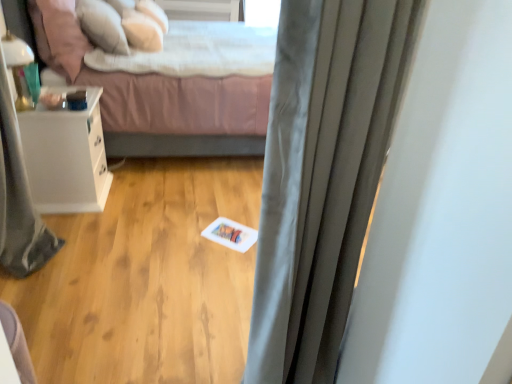
Question: From a real-world perspective, is soft pink fabric bed at center on top of satin gray curtain at center?

Choices:
 (A) no
 (B) yes

Answer: (A)

Question: Is soft pink fabric bed at center shorter than satin gray curtain at center?

Choices:
 (A) no
 (B) yes

Answer: (B)

Question: Is soft pink fabric bed at center wider than satin gray curtain at center?

Choices:
 (A) yes
 (B) no

Answer: (A)

Question: From a real-world perspective, does soft pink fabric bed at center sit lower than satin gray curtain at center?

Choices:
 (A) no
 (B) yes

Answer: (B)

Question: Does soft pink fabric bed at center have a smaller size compared to satin gray curtain at center?

Choices:
 (A) yes
 (B) no

Answer: (B)

Question: From the image's perspective, is soft pink fabric bed at center located above satin gray curtain at center?

Choices:
 (A) no
 (B) yes

Answer: (B)

Question: Can you confirm if gray fabric shower curtain at left is smaller than white glossy nightstand at left?

Choices:
 (A) yes
 (B) no

Answer: (B)

Question: From a real-world perspective, is gray fabric shower curtain at left positioned under white glossy nightstand at left based on gravity?

Choices:
 (A) yes
 (B) no

Answer: (B)

Question: Is white glossy nightstand at left located within gray fabric shower curtain at left?

Choices:
 (A) yes
 (B) no

Answer: (B)

Question: Is gray fabric shower curtain at left facing away from white glossy nightstand at left?

Choices:
 (A) no
 (B) yes

Answer: (A)

Question: Does gray fabric shower curtain at left have a lesser width compared to white glossy nightstand at left?

Choices:
 (A) yes
 (B) no

Answer: (A)

Question: Is gray fabric shower curtain at left directly adjacent to white glossy nightstand at left?

Choices:
 (A) no
 (B) yes

Answer: (A)

Question: Considering the relative sizes of white soft pillow at upper left, the second pillow positioned from the back, and gray fabric shower curtain at left in the image provided, is white soft pillow at upper left, the second pillow positioned from the back, shorter than gray fabric shower curtain at left?

Choices:
 (A) yes
 (B) no

Answer: (A)